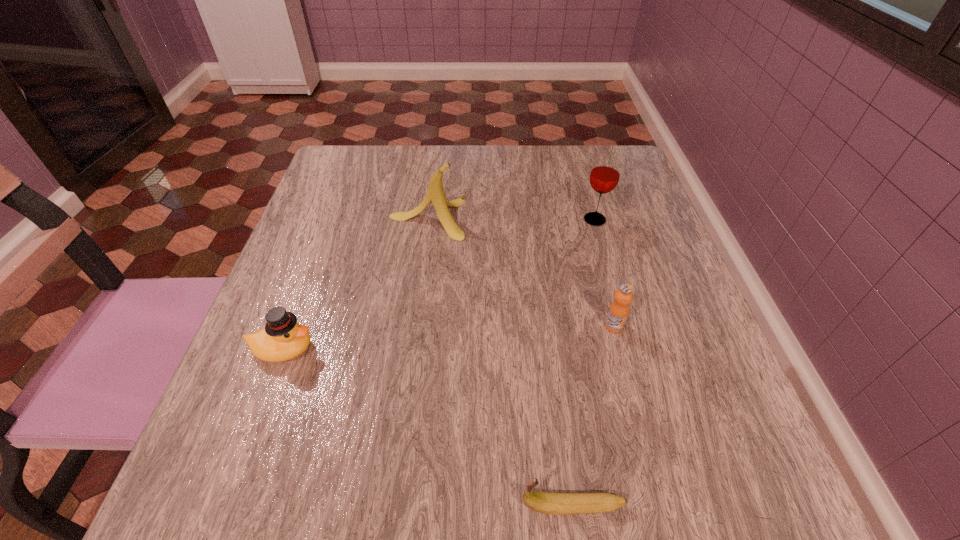
Find the location of a particular element. The height and width of the screenshot is (540, 960). blank area located 0.060m on the front-facing side of the leftmost object is located at coordinates (351, 349).

Identify the location of free spot located 0.090m at the stem of the nearer banana. (453, 506).

Where is `free space located at the stem of the nearer banana`? This screenshot has width=960, height=540. free space located at the stem of the nearer banana is located at coordinates (339, 506).

Identify the location of free point located 0.390m at the stem of the nearer banana. The width and height of the screenshot is (960, 540). [224, 506].

This screenshot has width=960, height=540. What are the coordinates of `object located at the far edge` in the screenshot? It's located at (435, 194).

The height and width of the screenshot is (540, 960). Find the location of `object located in the near edge section of the desktop`. object located in the near edge section of the desktop is located at coordinates (551, 503).

Where is `object present at the left edge`? The width and height of the screenshot is (960, 540). object present at the left edge is located at coordinates (283, 338).

Locate an element on the screen. glass that is at the right edge is located at coordinates (605, 173).

Identify the location of orange juice situated at the right edge. This screenshot has width=960, height=540. (619, 309).

In the image, there is a desktop. Identify the location of vacant space at the far edge. (390, 177).